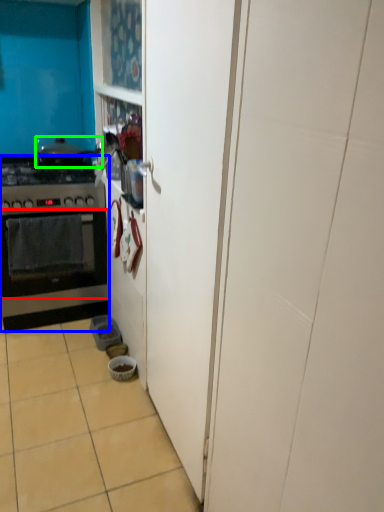
Question: Which object is positioned closest to oven (highlighted by a red box)? Select from kitchen appliance (highlighted by a blue box) and pot/pan (highlighted by a green box).

Choices:
 (A) kitchen appliance
 (B) pot/pan

Answer: (A)